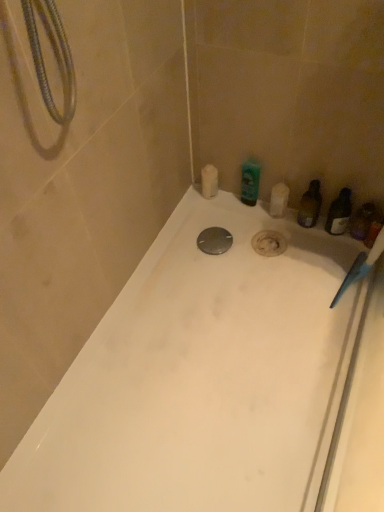
This screenshot has width=384, height=512. I want to click on unoccupied region to the right of metallic silver drain at center, so (x=262, y=245).